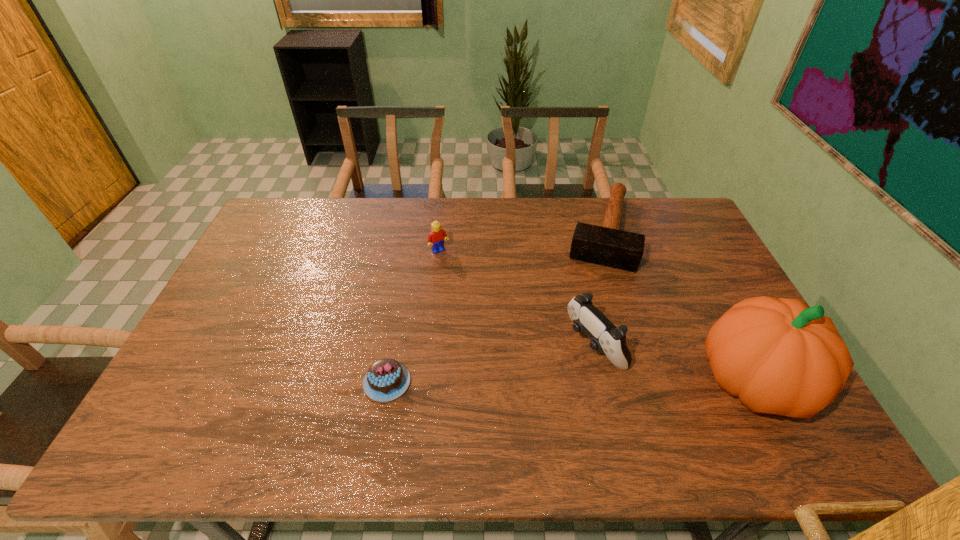
The image size is (960, 540). I want to click on the leftmost object, so click(x=386, y=379).

Image resolution: width=960 pixels, height=540 pixels. What are the coordinates of `chocolate cake` in the screenshot? It's located at (386, 379).

I want to click on the tallest object, so click(779, 356).

Locate an element on the screen. Image resolution: width=960 pixels, height=540 pixels. mallet is located at coordinates (606, 245).

Image resolution: width=960 pixels, height=540 pixels. Identify the location of the fourth object from right to left. (436, 237).

Where is `the third shortest object`? The height and width of the screenshot is (540, 960). the third shortest object is located at coordinates (436, 237).

Locate an element on the screen. control is located at coordinates (605, 336).

I want to click on blank area located on the right of the chocolate cake, so click(x=430, y=382).

You are a GUI agent. You are given a task and a screenshot of the screen. Output one action in this format:
    pyautogui.click(x=<x>, y=<y>)
    Task: Click on the vacant area situated 0.300m on the back of the tallest object
    This screenshot has width=960, height=540.
    Given the screenshot: What is the action you would take?
    pyautogui.click(x=693, y=266)

Locate an element on the screen. This screenshot has width=960, height=540. free location located on the striking face of the second shortest object is located at coordinates (x=582, y=352).